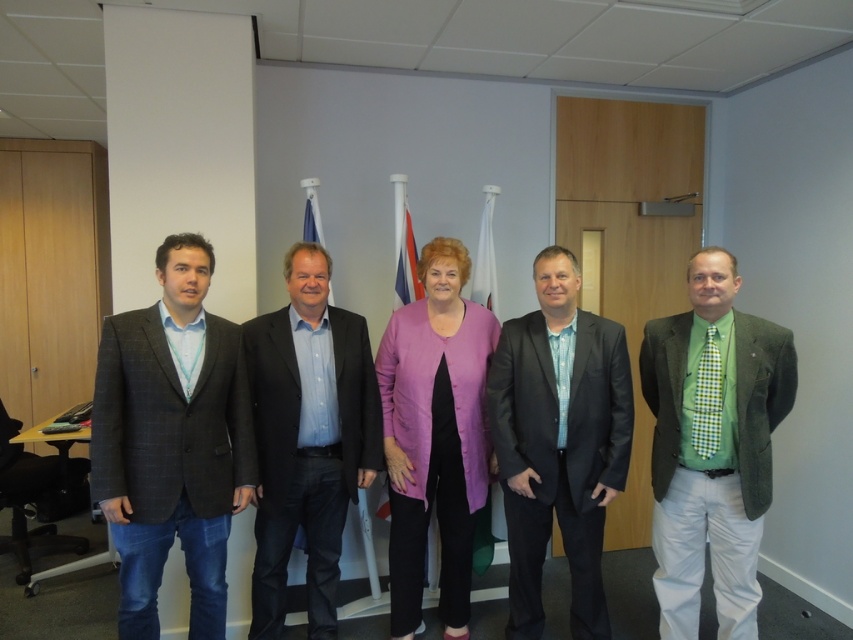
Which is more to the left, green plaid tie at right or blue shirt at center?

Positioned to the left is blue shirt at center.

You are a GUI agent. You are given a task and a screenshot of the screen. Output one action in this format:
    pyautogui.click(x=<x>, y=<y>)
    Task: Click on the green plaid tie at right
    The image size is (853, 640).
    Given the screenshot: What is the action you would take?
    pyautogui.click(x=712, y=445)

Does dark gray checkered suit at left appear on the right side of green plaid tie at right?

Incorrect, dark gray checkered suit at left is not on the right side of green plaid tie at right.

Locate an element on the screen. The height and width of the screenshot is (640, 853). dark gray checkered suit at left is located at coordinates (172, 442).

Locate an element on the screen. This screenshot has width=853, height=640. dark gray checkered suit at left is located at coordinates (172, 442).

Can you confirm if purple fabric jacket at center is taller than red fabric flag at center?

Indeed, purple fabric jacket at center has a greater height compared to red fabric flag at center.

Between point (445, 538) and point (407, 225), which one is positioned in front?

Point (445, 538)

I want to click on purple fabric jacket at center, so click(434, 435).